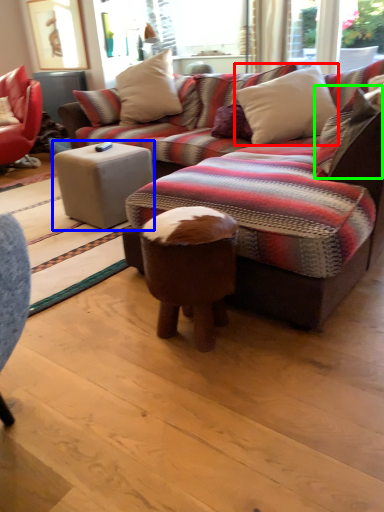
Question: Based on their relative distances, which object is farther from pillow (highlighted by a red box)? Choose from table (highlighted by a blue box) and pillow (highlighted by a green box).

Choices:
 (A) table
 (B) pillow

Answer: (A)